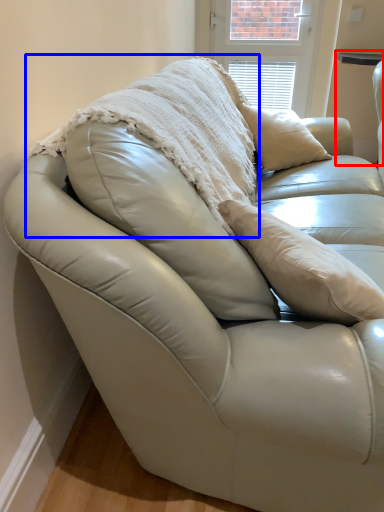
Question: Which of the following is the closest to the observer, table (highlighted by a red box) or blanket (highlighted by a blue box)?

Choices:
 (A) table
 (B) blanket

Answer: (B)